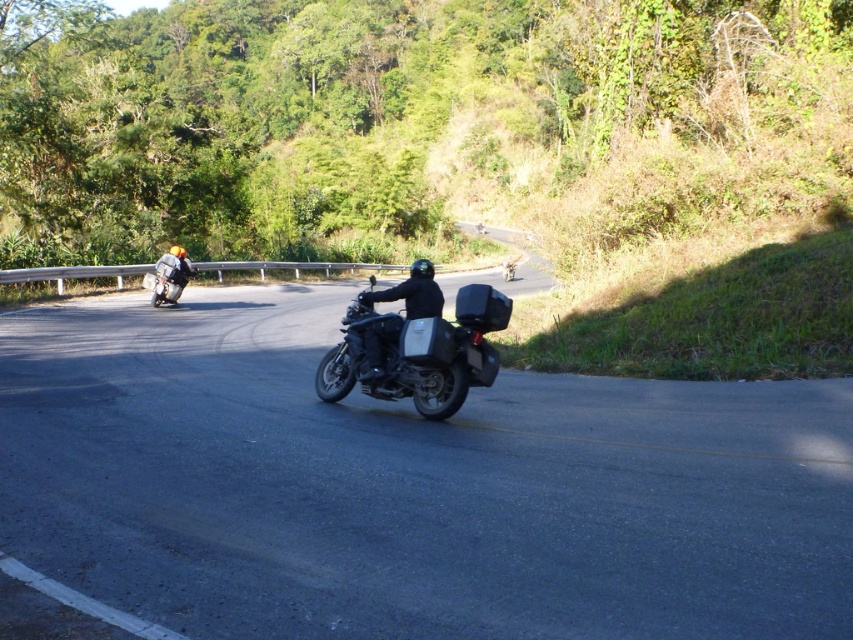
You are a hiker who wants to cross the road safely. There is a black asphalt road at center at point (408, 486). Where should you cross the road to ensure safety?

The black asphalt road at center is located at point (408, 486). To cross safely, you should look both ways, confirm no vehicles are approaching, and cross at this point as it is the designated road center for safe crossings.

You are a passenger in a car parked at the starting point of the road. You see a matte black motorcycle at center. Where is the point with coordinates point (416, 352) located?

The point with coordinates point (416, 352) is located on the matte black motorcycle at center.

You are a cyclist planning to overtake the matte black motorcycle at left on the black asphalt road at center. Is there enough space on the road to safely pass the motorcycle?

The black asphalt road at center is positioned under the matte black motorcycle at left, which means the motorcycle is on the road. Since the road has a double yellow line indicating two way traffic, overtaking may not be permitted here. Check local traffic rules before attempting to pass.